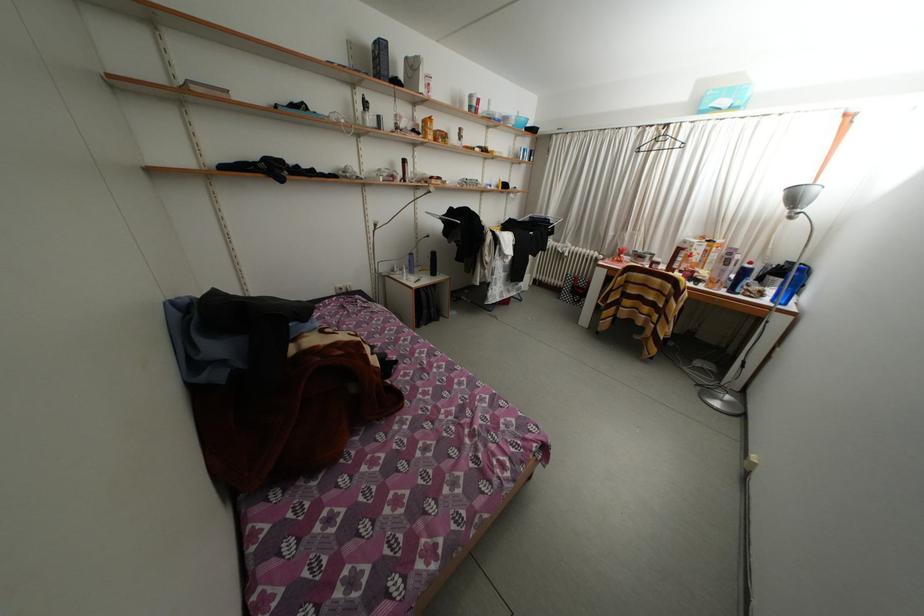
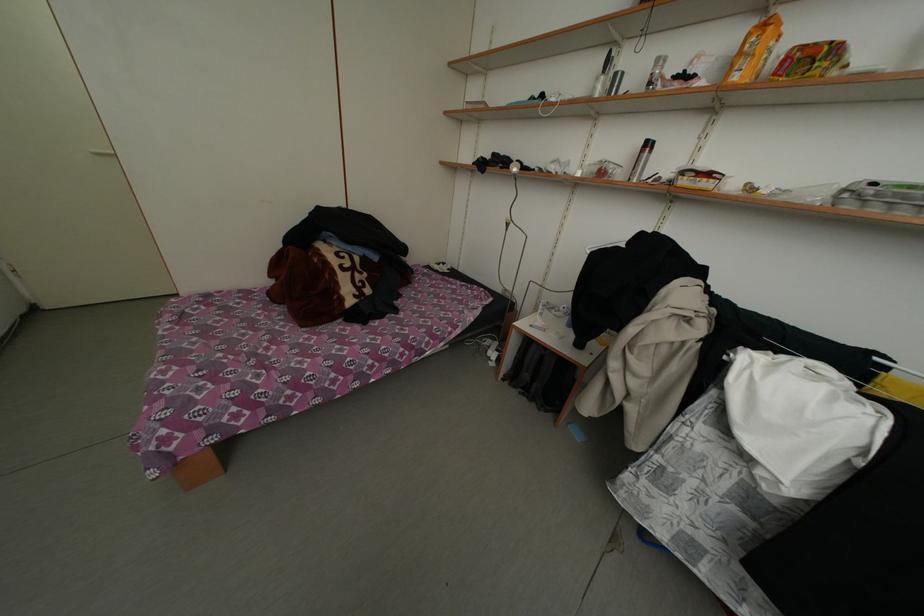
Locate, in the second image, the point that corresponds to (438,123) in the first image.

(774, 29)